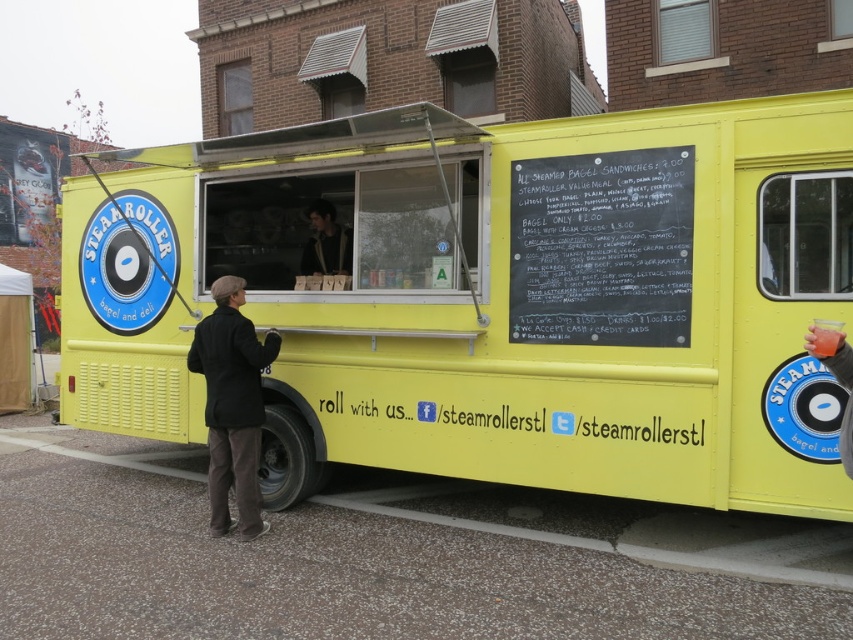
You are a customer looking to purchase a coat and jacket from the food truck. The vendor tells you that the black wool coat at lower left is below the dark brown leather jacket at center. Which item would you need to reach first to get the jacket?

The black wool coat at lower left is located below the dark brown leather jacket at center, so you would need to reach the dark brown leather jacket at center first as it is above the coat.

You are a customer standing in front of the yellow matte food truck at center and the black chalkboard at upper center. Which object is larger in size?

The yellow matte food truck at center is bigger than the black chalkboard at upper center.